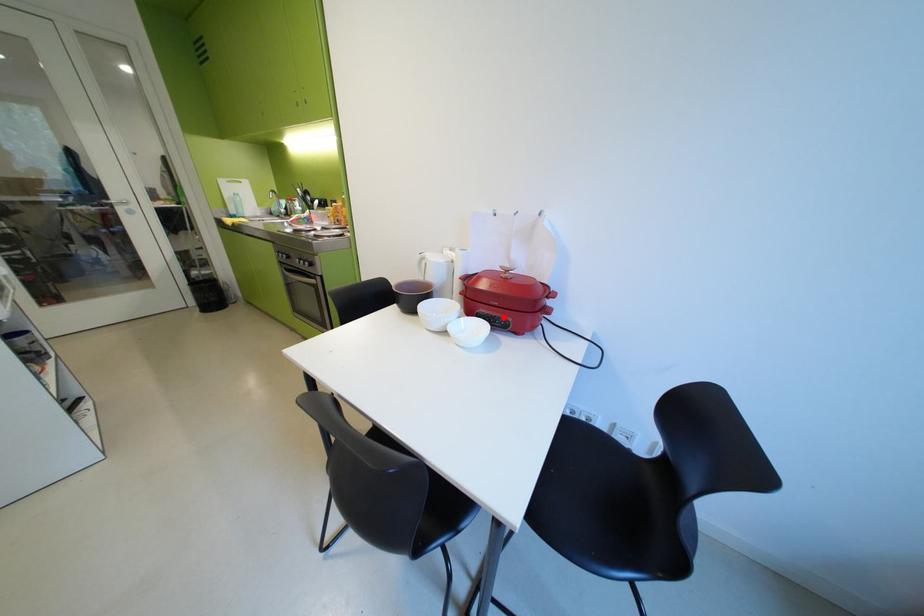
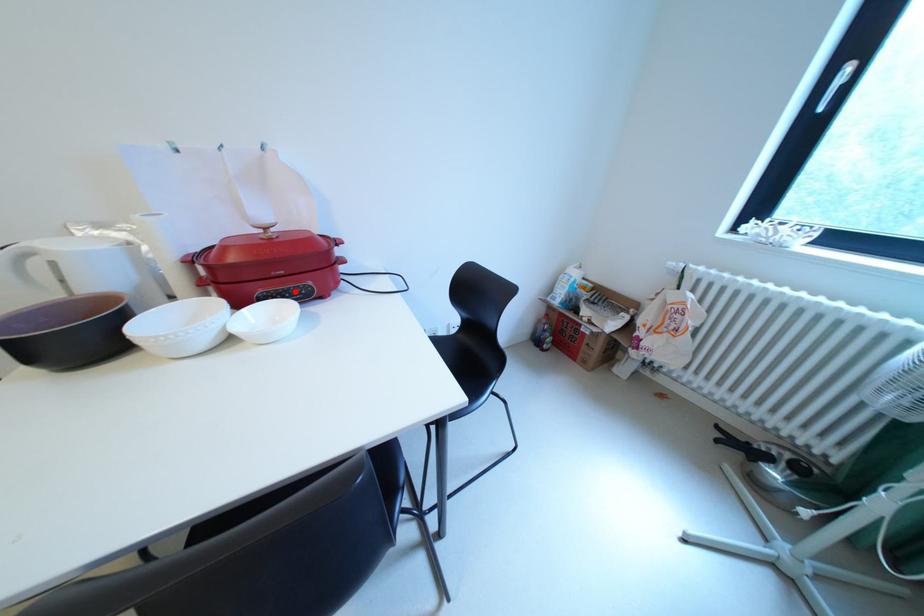
I am providing you with two images of the same scene from different viewpoints. A red point is marked on the first image and another point is marked on the second image. Does the point marked in image1 correspond to the same location as the one in image2?

Yes